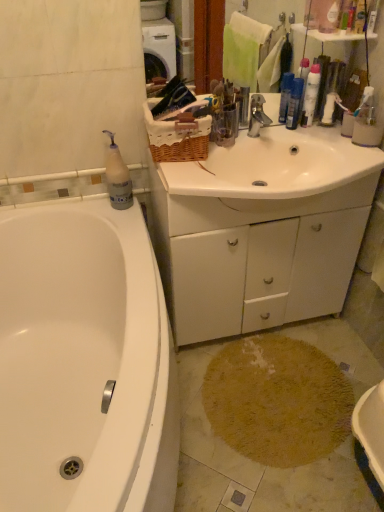
Find the location of a particular element. free spot to the right of blue plastic bottles at upper right, the 2th toiletry when ordered from front to back is located at coordinates (313, 129).